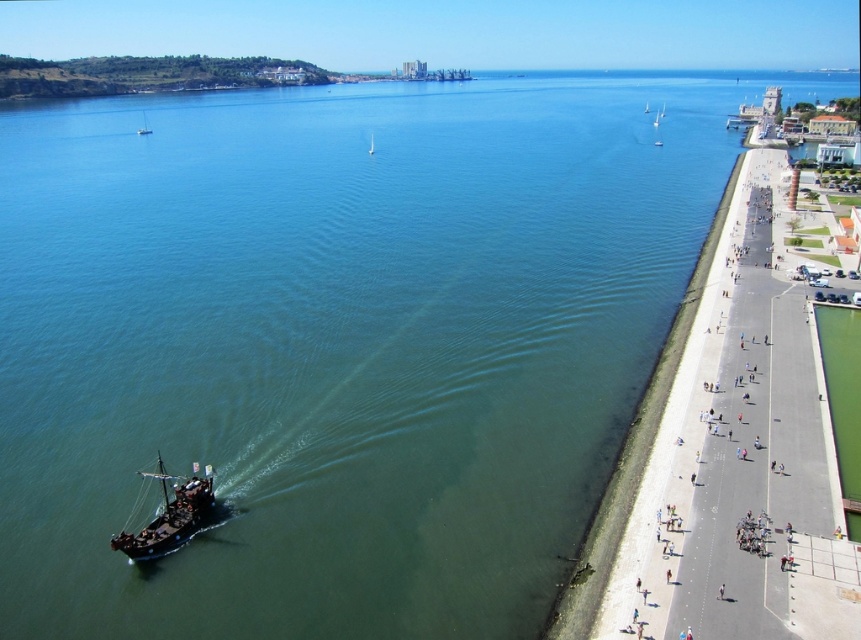
Identify the location of wooden sailboat at upper center. Image resolution: width=861 pixels, height=640 pixels. (144, 125).

Is point (140, 129) positioned behind point (373, 147)?

That is True.

The width and height of the screenshot is (861, 640). I want to click on wooden sailboat at upper center, so click(144, 125).

Between wooden ship at lower left and white glossy sailboat at center, which one has more height?

With more height is white glossy sailboat at center.

Does wooden ship at lower left have a lesser height compared to white glossy sailboat at center?

Yes.

Identify the location of wooden ship at lower left. The image size is (861, 640). (172, 513).

Where is `wooden ship at lower left`? wooden ship at lower left is located at coordinates (172, 513).

How much distance is there between wooden ship at lower left and wooden sailboat at upper center?

wooden ship at lower left is 284.95 meters from wooden sailboat at upper center.

Which of these two, wooden ship at lower left or wooden sailboat at upper center, stands taller?

With more height is wooden sailboat at upper center.

Where is `wooden ship at lower left`? This screenshot has width=861, height=640. wooden ship at lower left is located at coordinates (172, 513).